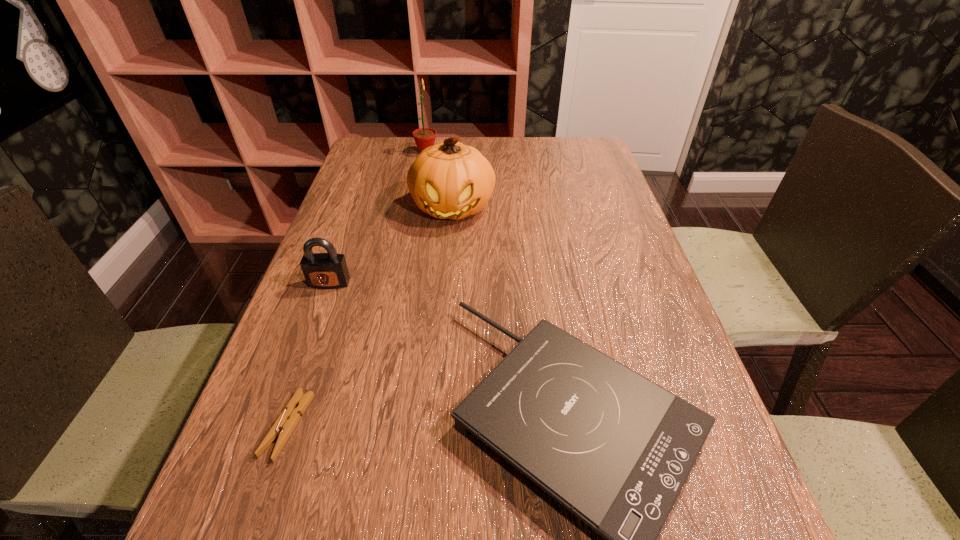
What are the coordinates of `sunflower` in the screenshot? It's located at (424, 137).

You are a GUI agent. You are given a task and a screenshot of the screen. Output one action in this format:
    pyautogui.click(x=<x>, y=<y>)
    Task: Click on the pumpkin
    
    Given the screenshot: What is the action you would take?
    pyautogui.click(x=450, y=180)

The height and width of the screenshot is (540, 960). Identify the location of padlock. (329, 270).

Where is `the third shortest object`? Image resolution: width=960 pixels, height=540 pixels. the third shortest object is located at coordinates (329, 270).

Where is `the shortest object`? This screenshot has height=540, width=960. the shortest object is located at coordinates (287, 421).

The height and width of the screenshot is (540, 960). What are the coordinates of `free region located on the face of the sunflower` in the screenshot? It's located at (479, 152).

Image resolution: width=960 pixels, height=540 pixels. In order to click on vacant space located 0.080m on the front face of the pumpkin in this screenshot , I will do `click(449, 254)`.

The image size is (960, 540). In order to click on vacant space positioned 0.060m on the front of the third farthest object near the keyhole in this screenshot , I will do [319, 311].

Locate an element on the screen. The height and width of the screenshot is (540, 960). vacant region located on the back of the shortest object is located at coordinates (324, 318).

The image size is (960, 540). I want to click on object present at the far edge, so click(424, 137).